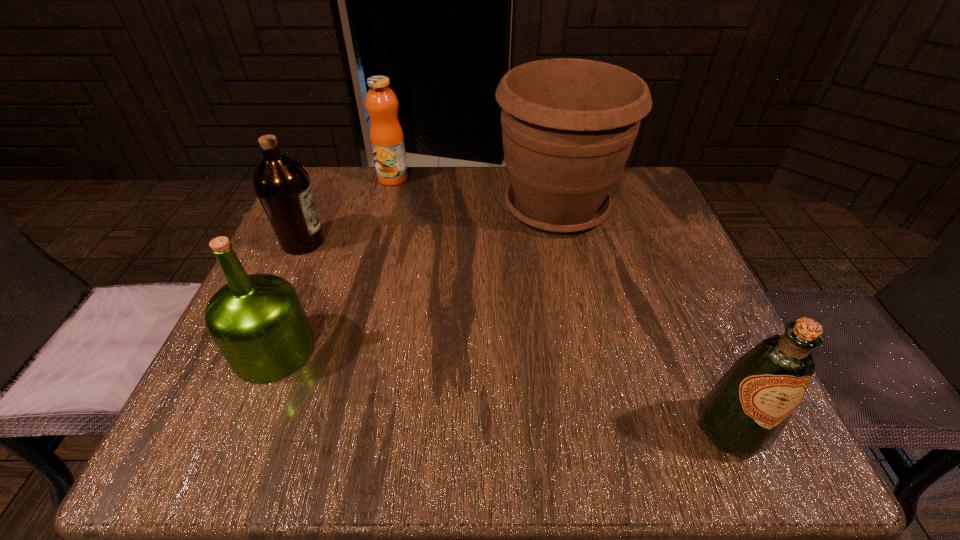
The width and height of the screenshot is (960, 540). Find the location of `flowerpot`. flowerpot is located at coordinates (568, 125).

Where is `fruit juice`? The image size is (960, 540). fruit juice is located at coordinates (386, 135).

Identify the location of the farthest olive oil. (283, 186).

The height and width of the screenshot is (540, 960). Identify the location of the fourth farthest object. (257, 321).

Locate an element on the screen. Image resolution: width=960 pixels, height=540 pixels. the nearest olive oil is located at coordinates (744, 413).

Where is `the nearest object`? This screenshot has width=960, height=540. the nearest object is located at coordinates (744, 413).

Locate an element on the screen. The image size is (960, 540). free region located 0.340m on the left of the flowerpot is located at coordinates (345, 208).

Where is `blank space located 0.060m on the front of the fruit juice`? This screenshot has width=960, height=540. blank space located 0.060m on the front of the fruit juice is located at coordinates (387, 200).

Find the location of a particular element. The width and height of the screenshot is (960, 540). free space located 0.180m on the label of the farthest olive oil is located at coordinates (413, 242).

Find the location of a particular element. vacant region located 0.180m on the back of the second farthest olive oil is located at coordinates (314, 253).